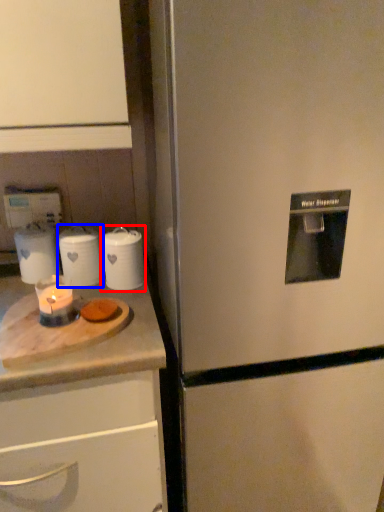
Question: Which object is further to the camera taking this photo, kitchen appliance (highlighted by a red box) or kitchen appliance (highlighted by a blue box)?

Choices:
 (A) kitchen appliance
 (B) kitchen appliance

Answer: (B)